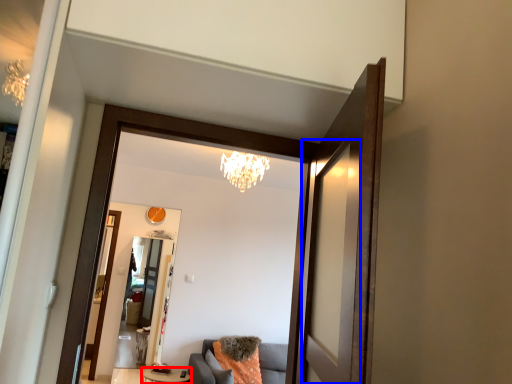
Question: Which object is closer to the camera taking this photo, table (highlighted by a red box) or screen door (highlighted by a blue box)?

Choices:
 (A) table
 (B) screen door

Answer: (B)